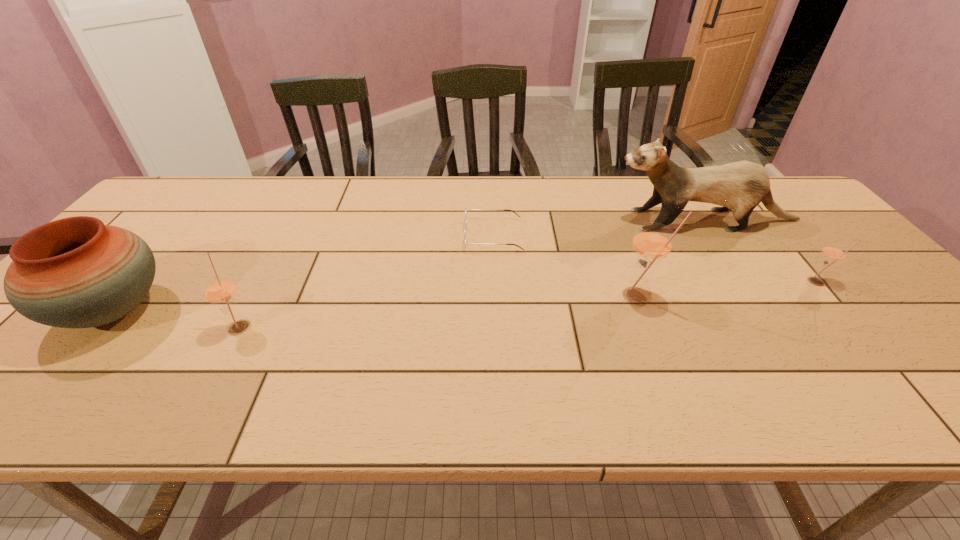
You are a GUI agent. You are given a task and a screenshot of the screen. Output one action in this format:
    pyautogui.click(x=<x>, y=<y>)
    Task: Click on the fifth object from right to left
    
    Given the screenshot: What is the action you would take?
    pyautogui.click(x=220, y=291)

Locate an element on the screen. The width and height of the screenshot is (960, 540). the second tallest straw is located at coordinates (220, 291).

Locate an element on the screen. Image resolution: width=960 pixels, height=540 pixels. the second straw from right to left is located at coordinates (652, 242).

Identify the location of the fifth tallest object. (833, 253).

Identify the location of the rightmost straw. (833, 253).

Locate an element on the screen. The height and width of the screenshot is (540, 960). the fourth object from right to left is located at coordinates (465, 243).

This screenshot has width=960, height=540. In order to click on spectacles in this screenshot , I will do `click(465, 243)`.

Where is `ferret`? ferret is located at coordinates (742, 185).

Locate an element on the screen. The width and height of the screenshot is (960, 540). the leftmost object is located at coordinates (76, 272).

I want to click on free space located 0.380m on the back of the second tallest straw, so click(x=296, y=221).